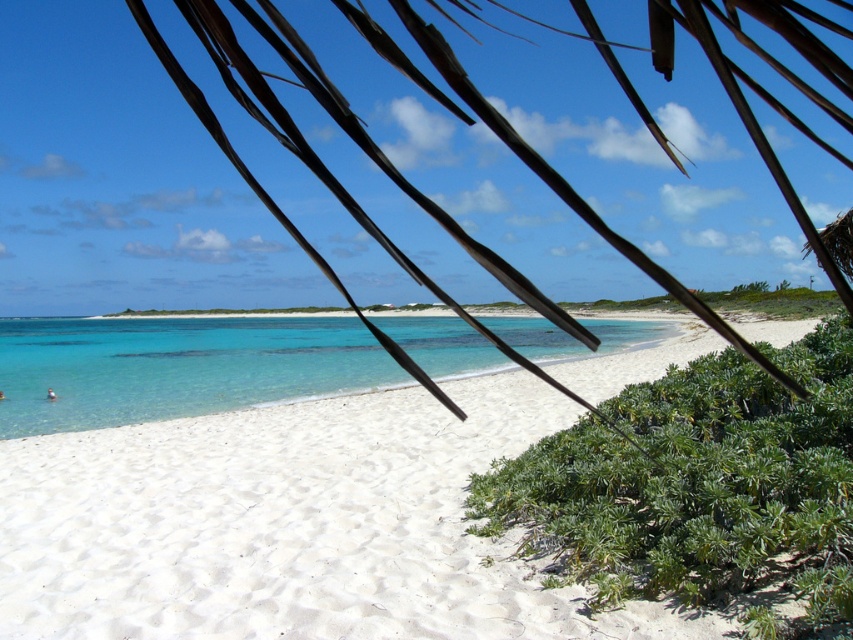
You are standing on the beach and want to walk to the water, which is beyond the white sand beach at center. If your walking speed is 1.5 meters per second, how many seconds will it take you to reach the water?

The distance between you and the white sand beach at center is 3.14 meters. At a speed of 1.5 meters per second, it would take approximately 2.09 seconds to reach the water.

You are planning to build a small sandcastle on the white sand beach at center and want to place a decorative bush next to it. Given the space available, can the green leafy bush at lower right fit next to the sandcastle without overlapping?

The white sand beach at center is wider than the green leafy bush at lower right, so there should be enough space to place the bush next to the sandcastle without overlapping.